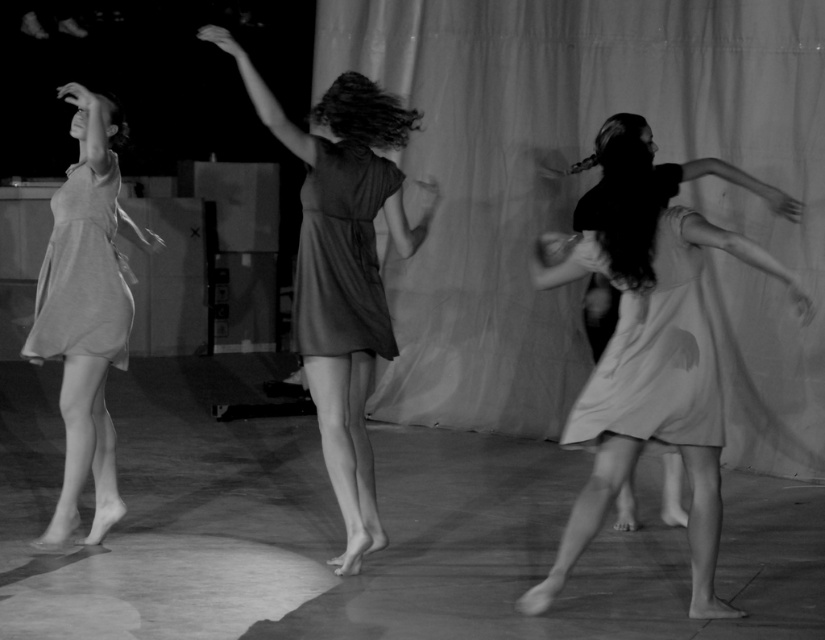
Can you confirm if matte dark dress at center is taller than matte white dress at right?

Indeed, matte dark dress at center has a greater height compared to matte white dress at right.

Measure the distance between matte dark dress at center and camera.

The distance of matte dark dress at center from camera is 5.29 meters.

You are a GUI agent. You are given a task and a screenshot of the screen. Output one action in this format:
    pyautogui.click(x=<x>, y=<y>)
    Task: Click on the matte dark dress at center
    
    Given the screenshot: What is the action you would take?
    pyautogui.click(x=342, y=269)

Is matte gray dress at left positioned in front of matte white dress at right?

No, it is not.

Is point (66, 237) closer to camera compared to point (724, 412)?

No, (66, 237) is further to viewer.

Identify the location of matte gray dress at left. (86, 310).

What do you see at coordinates (342, 253) in the screenshot? Image resolution: width=825 pixels, height=640 pixels. I see `satin dress at center` at bounding box center [342, 253].

Which is in front, point (310, 202) or point (109, 227)?

Point (310, 202) is in front.

What are the coordinates of `satin dress at center` in the screenshot? It's located at (342, 253).